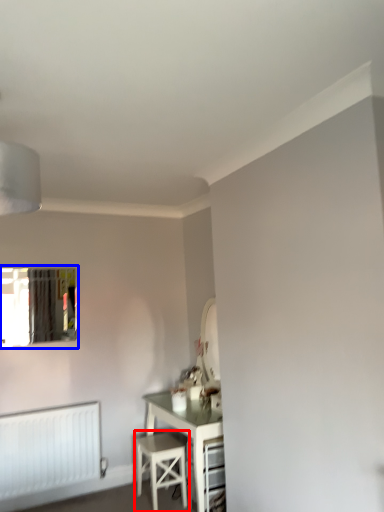
Question: Which object is closer to the camera taking this photo, stool (highlighted by a red box) or window (highlighted by a blue box)?

Choices:
 (A) stool
 (B) window

Answer: (A)